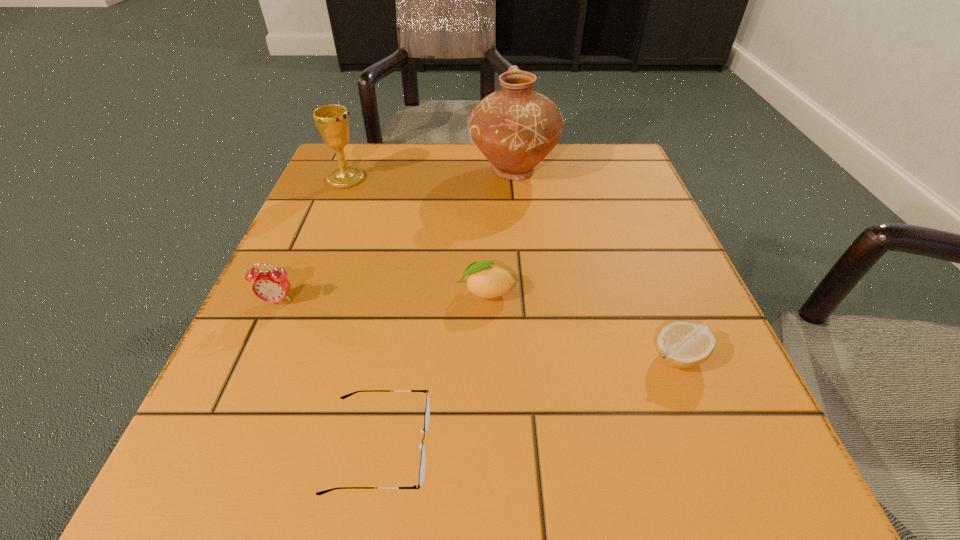
The width and height of the screenshot is (960, 540). I want to click on alarm clock at the left edge, so click(273, 286).

What are the coordinates of `object that is at the right edge` in the screenshot? It's located at (682, 345).

Find the location of a particular element. The width and height of the screenshot is (960, 540). object that is positioned at the far left corner is located at coordinates (332, 121).

The height and width of the screenshot is (540, 960). What are the coordinates of `free space at the far edge` in the screenshot? It's located at (512, 180).

Where is `free space at the left edge of the desktop`? This screenshot has height=540, width=960. free space at the left edge of the desktop is located at coordinates (330, 341).

The height and width of the screenshot is (540, 960). I want to click on free space at the right edge of the desktop, so click(x=653, y=241).

In the image, there is a desktop. At what (x,y) coordinates should I click in order to perform the action: click on free region at the far left corner. Please return your answer as a coordinate pair (x, y). Looking at the image, I should click on (395, 151).

Where is `vacant region at the near left corner of the desktop`? This screenshot has width=960, height=540. vacant region at the near left corner of the desktop is located at coordinates (193, 443).

In the image, there is a desktop. Where is `free space at the far right corner`? The image size is (960, 540). free space at the far right corner is located at coordinates (636, 192).

In the image, there is a desktop. At what (x,y) coordinates should I click in order to perform the action: click on vacant space at the near right corner. Please return your answer as a coordinate pair (x, y). The width and height of the screenshot is (960, 540). Looking at the image, I should click on (660, 484).